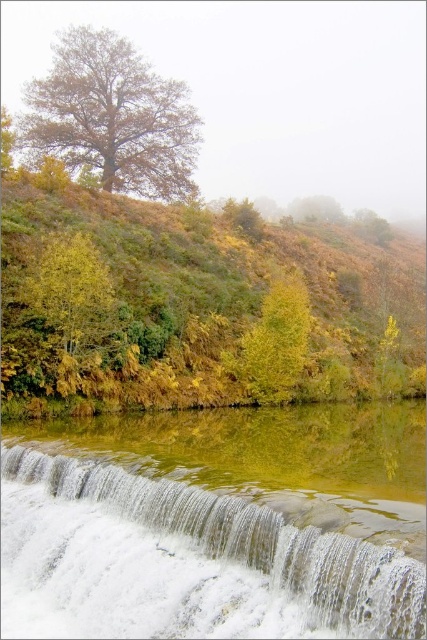
Between green leafy hillside at lower left and brown matte tree at upper left, which one appears on the right side from the viewer's perspective?

green leafy hillside at lower left

From the picture: Is green leafy hillside at lower left to the right of brown matte tree at upper left from the viewer's perspective?

Correct, you'll find green leafy hillside at lower left to the right of brown matte tree at upper left.

This screenshot has width=427, height=640. I want to click on green leafy hillside at lower left, so click(193, 307).

This screenshot has width=427, height=640. What are the coordinates of `green leafy hillside at lower left` in the screenshot? It's located at (193, 307).

Between green leafy hillside at lower left and yellow-green leafy tree at center, which one appears on the right side from the viewer's perspective?

green leafy hillside at lower left is more to the right.

Between point (101, 330) and point (271, 381), which one is positioned behind?

The point (271, 381) is more distant.

What are the coordinates of `green leafy hillside at lower left` in the screenshot? It's located at (193, 307).

Between green leafy hillside at lower left and white frothy water at lower center, which one has less height?

Standing shorter between the two is white frothy water at lower center.

Does green leafy hillside at lower left appear over white frothy water at lower center?

Yes, green leafy hillside at lower left is above white frothy water at lower center.

The height and width of the screenshot is (640, 427). In order to click on green leafy hillside at lower left in this screenshot , I will do `click(193, 307)`.

Image resolution: width=427 pixels, height=640 pixels. Find the location of `green leafy hillside at lower left`. green leafy hillside at lower left is located at coordinates (193, 307).